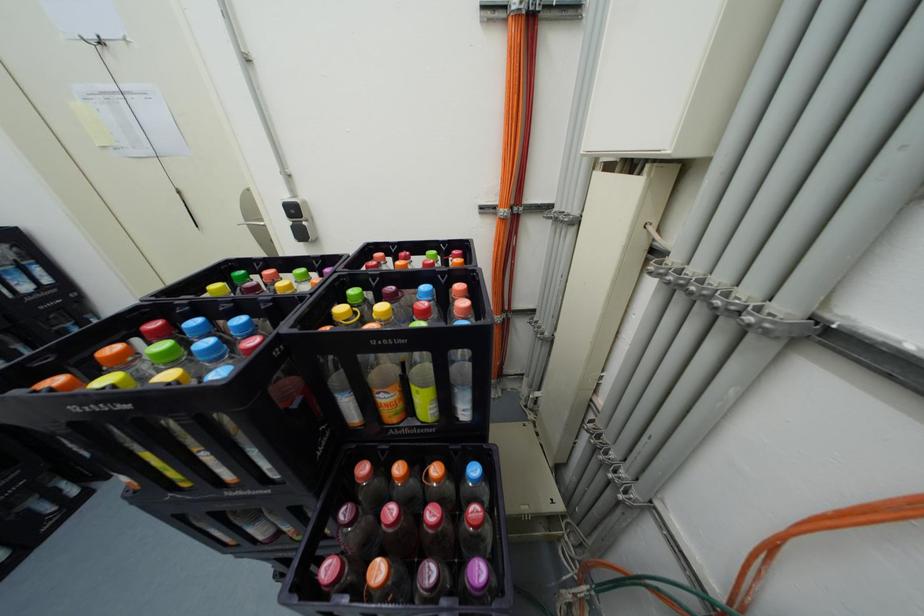
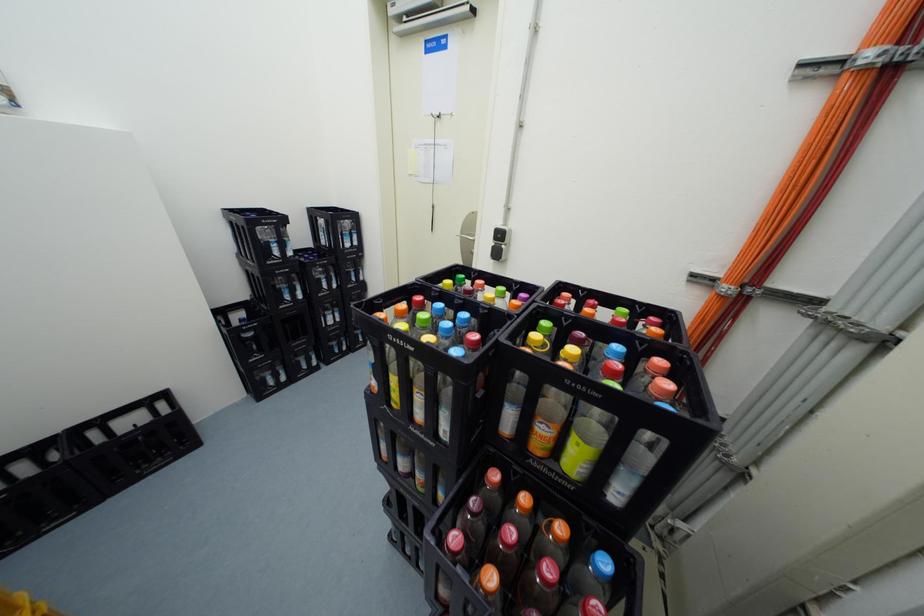
Question: The camera is either moving clockwise (left) or counter-clockwise (right) around the object. The first image is from the beginning of the video and the second image is from the end. Is the camera moving left or right when shooting the video?

Choices:
 (A) Left
 (B) Right

Answer: (B)